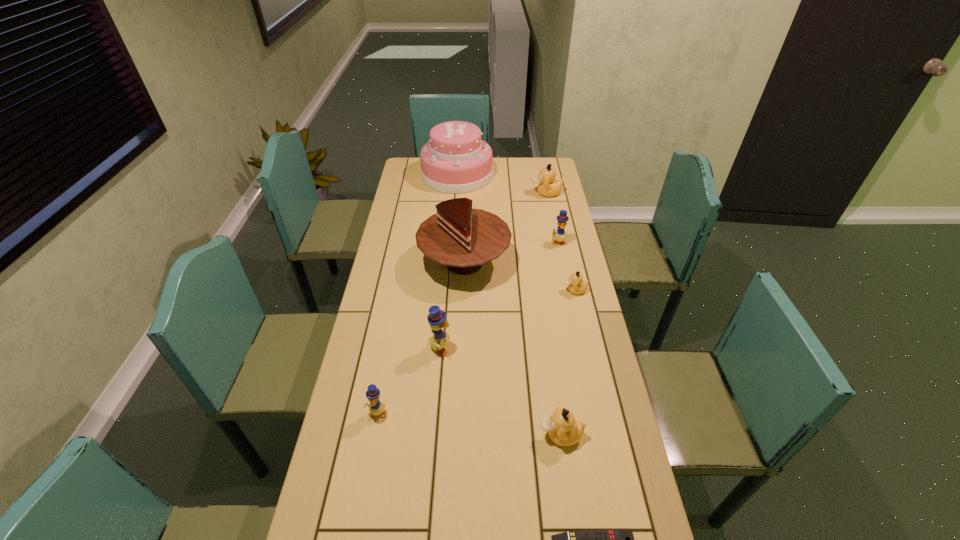
Identify the location of unoccupied position between the second nearest object and the biggest tan duckling. (553, 314).

Where is `free space between the nearest tan duckling and the red cake`? The width and height of the screenshot is (960, 540). free space between the nearest tan duckling and the red cake is located at coordinates (513, 349).

Image resolution: width=960 pixels, height=540 pixels. In order to click on empty location between the nearest yellow duckling and the shortest duckling in this screenshot , I will do `click(476, 352)`.

Choose which object is the third nearest neighbor to the third tallest object. Please provide its 2D coordinates. Your answer should be formatted as a tuple, i.e. [(x, y)], where the tuple contains the x and y coordinates of a point satisfying the conditions above.

[(564, 430)]

Point out which object is positioned as the second nearest to the tallest duckling. Please provide its 2D coordinates. Your answer should be formatted as a tuple, i.e. [(x, y)], where the tuple contains the x and y coordinates of a point satisfying the conditions above.

[(463, 238)]

Find the location of a particular element. duckling that stands as the closest to the leftmost yellow duckling is located at coordinates (436, 318).

You are a GUI agent. You are given a task and a screenshot of the screen. Output one action in this format:
    pyautogui.click(x=<x>, y=<y>)
    Task: Click on the duckling that can be found as the third closest to the remote control
    The image size is (960, 540).
    Given the screenshot: What is the action you would take?
    pos(436,318)

Identify which yellow duckling is the second nearest to the tallest duckling. Please provide its 2D coordinates. Your answer should be formatted as a tuple, i.e. [(x, y)], where the tuple contains the x and y coordinates of a point satisfying the conditions above.

[(560, 235)]

Choose which yellow duckling is the nearest neighbor to the fourth nearest object. Please provide its 2D coordinates. Your answer should be formatted as a tuple, i.e. [(x, y)], where the tuple contains the x and y coordinates of a point satisfying the conditions above.

[(376, 407)]

Where is `the closest tan duckling relative to the second farthest duckling`? The image size is (960, 540). the closest tan duckling relative to the second farthest duckling is located at coordinates click(576, 285).